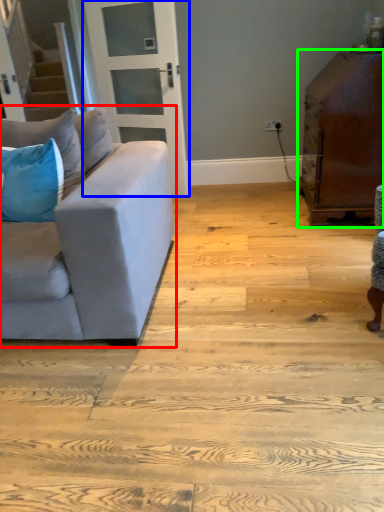
Question: Estimate the real-world distances between objects in this image. Which object is closer to studio couch (highlighted by a red box), door (highlighted by a blue box) or table (highlighted by a green box)?

Choices:
 (A) door
 (B) table

Answer: (B)